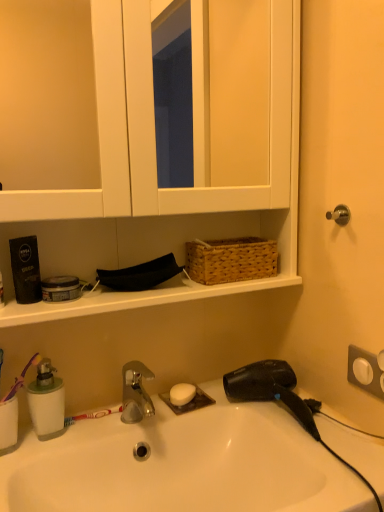
What are the coordinates of `unoccupied area in front of black plastic hair dryer at lower right` in the screenshot? It's located at (340, 467).